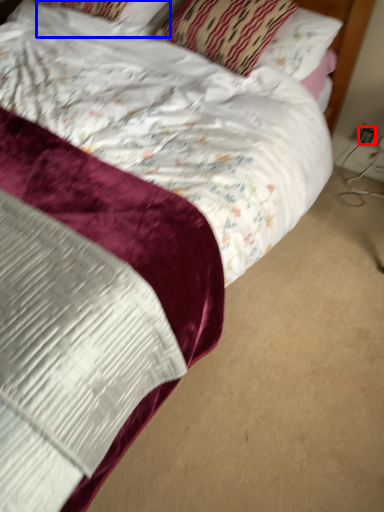
Question: Which point is further to the camera, electric outlet (highlighted by a red box) or pillow (highlighted by a blue box)?

Choices:
 (A) electric outlet
 (B) pillow

Answer: (A)